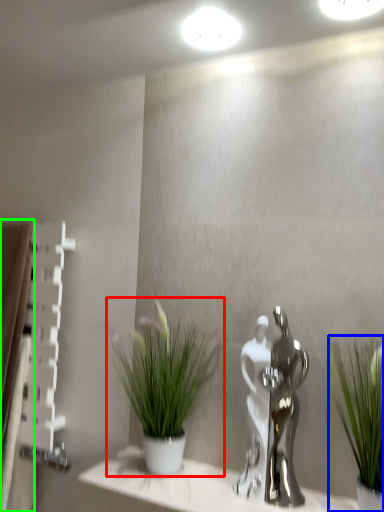
Question: Which object is positioned farthest from houseplant (highlighted by a red box)? Select from houseplant (highlighted by a blue box) and curtain (highlighted by a green box).

Choices:
 (A) houseplant
 (B) curtain

Answer: (B)